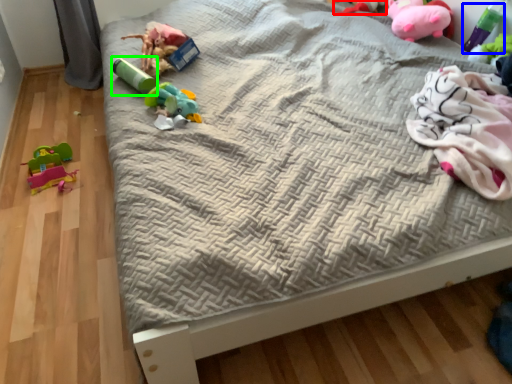
Question: Which object is positioned closest to toy (highlighted by a red box)? Select from toy (highlighted by a blue box) and toy (highlighted by a green box).

Choices:
 (A) toy
 (B) toy

Answer: (A)